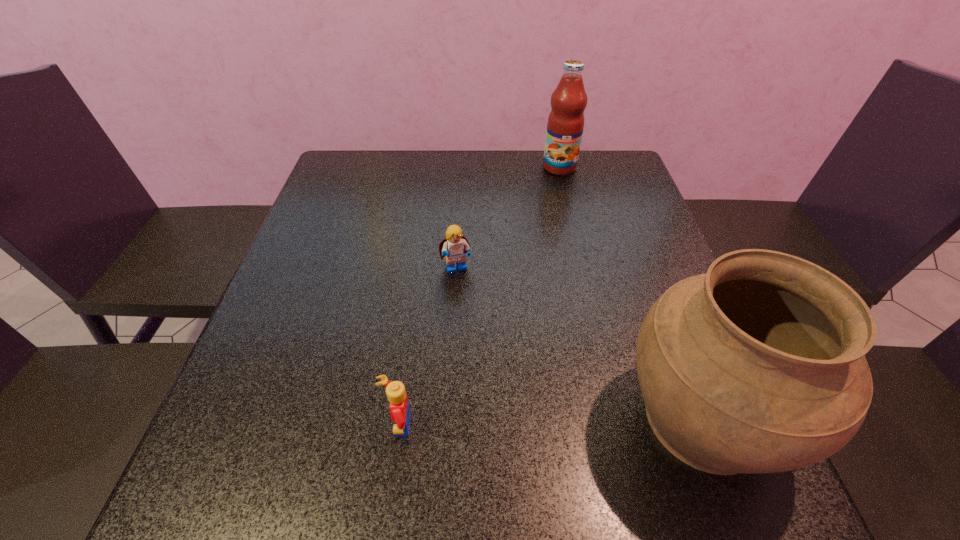
Where is `free space that is in between the urn and the leftmost object`? This screenshot has height=540, width=960. free space that is in between the urn and the leftmost object is located at coordinates (550, 422).

I want to click on free point between the farthest object and the urn, so (632, 293).

You are a GUI agent. You are given a task and a screenshot of the screen. Output one action in this format:
    pyautogui.click(x=<x>, y=<y>)
    Task: Click on the vacant region between the leftmost object and the fruit juice
    The height and width of the screenshot is (540, 960).
    Given the screenshot: What is the action you would take?
    pyautogui.click(x=478, y=296)

Locate an element on the screen. The image size is (960, 540). free space between the urn and the farther Lego is located at coordinates pyautogui.click(x=580, y=344).

Where is `free space between the left Lego and the fruit juice`? The image size is (960, 540). free space between the left Lego and the fruit juice is located at coordinates (478, 296).

Locate an element on the screen. empty space that is in between the urn and the second farthest object is located at coordinates (580, 344).

At what (x,y) coordinates should I click in order to perform the action: click on unoccupied position between the urn and the farther Lego. Please return your answer as a coordinate pair (x, y). Image resolution: width=960 pixels, height=540 pixels. Looking at the image, I should click on (580, 344).

Locate an element on the screen. The image size is (960, 540). vacant area between the second farthest object and the leftmost object is located at coordinates (427, 348).

Locate an element on the screen. free space between the farthest object and the left Lego is located at coordinates (478, 296).

This screenshot has height=540, width=960. In order to click on vacant space that's between the fruit juice and the farther Lego in this screenshot , I will do pos(508,219).